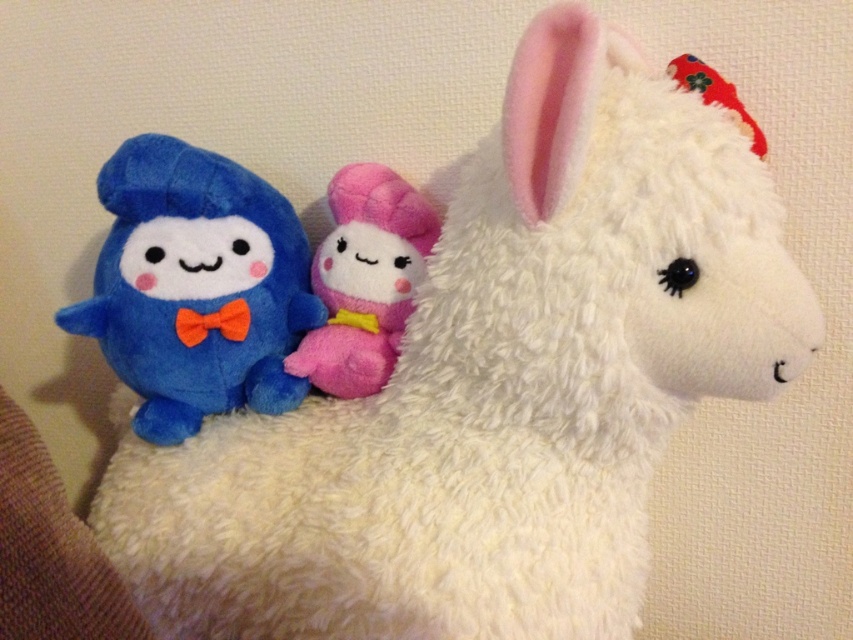
Can you confirm if blue plush toy at left is taller than pink plush toy at center?

Correct, blue plush toy at left is much taller as pink plush toy at center.

Can you confirm if blue plush toy at left is positioned to the right of pink plush toy at center?

Incorrect, blue plush toy at left is not on the right side of pink plush toy at center.

At what (x,y) coordinates should I click in order to perform the action: click on blue plush toy at left. Please return your answer as a coordinate pair (x, y). The width and height of the screenshot is (853, 640). Looking at the image, I should click on (196, 288).